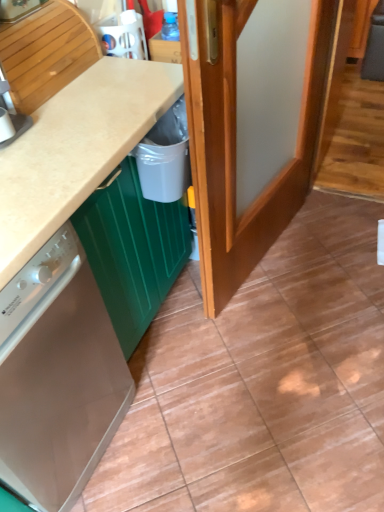
You are a GUI agent. You are given a task and a screenshot of the screen. Output one action in this format:
    pyautogui.click(x=<x>, y=<y>)
    Task: Click on the vacant space in front of wooden door at center
    This screenshot has width=384, height=512.
    Given the screenshot: What is the action you would take?
    (289, 355)